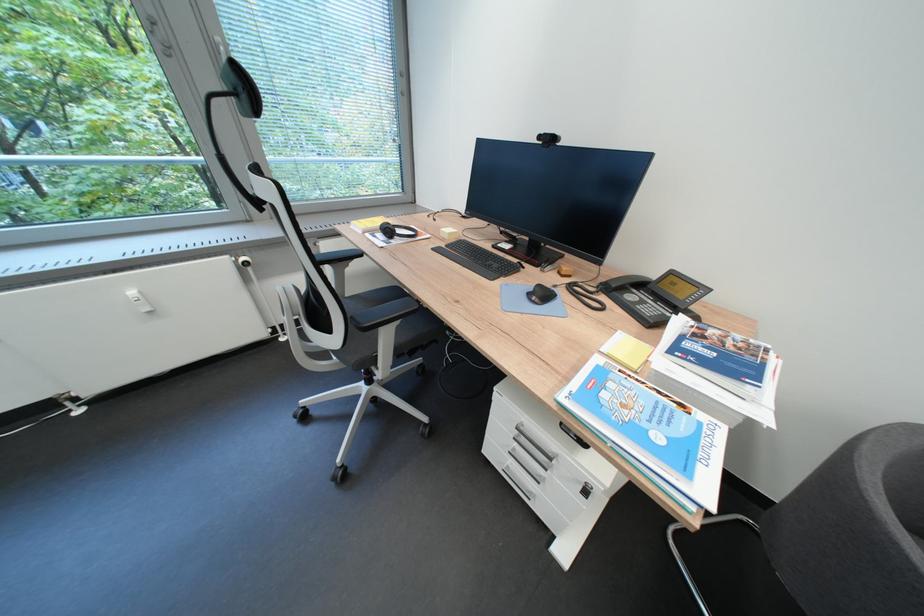
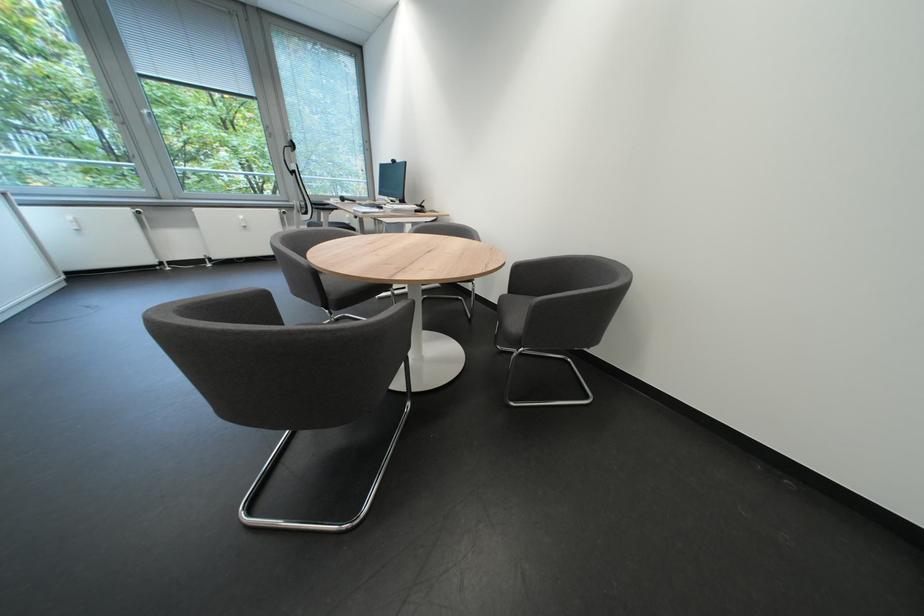
Find the pixel in the second image that matches pixel 137 75 in the first image.

(248, 146)